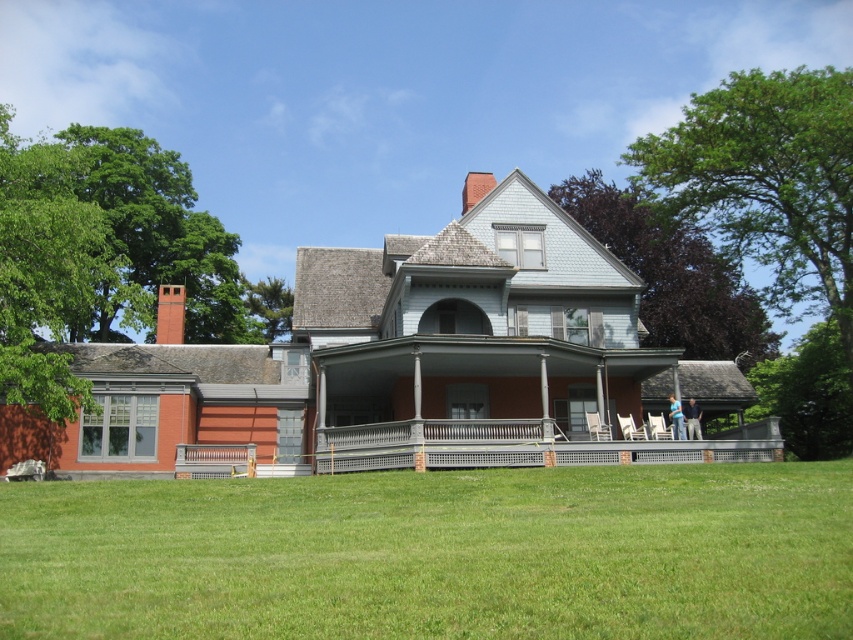
Can you confirm if gray wooden porch at center is bigger than blue jeans at center?

Indeed, gray wooden porch at center has a larger size compared to blue jeans at center.

You are a GUI agent. You are given a task and a screenshot of the screen. Output one action in this format:
    pyautogui.click(x=<x>, y=<y>)
    Task: Click on the gray wooden porch at center
    This screenshot has height=640, width=853.
    Given the screenshot: What is the action you would take?
    pyautogui.click(x=525, y=445)

You are a GUI agent. You are given a task and a screenshot of the screen. Output one action in this format:
    pyautogui.click(x=<x>, y=<y>)
    Task: Click on the gray wooden porch at center
    
    Given the screenshot: What is the action you would take?
    pyautogui.click(x=525, y=445)

Can you confirm if green grass at lower center is positioned above blue jeans at center?

No.

Can you confirm if green grass at lower center is bigger than blue jeans at center?

Yes.

Image resolution: width=853 pixels, height=640 pixels. What do you see at coordinates (436, 554) in the screenshot?
I see `green grass at lower center` at bounding box center [436, 554].

Where is `green grass at lower center`? green grass at lower center is located at coordinates (436, 554).

Can you confirm if gray wooden porch at center is smaller than blue fabric shirt at lower right?

No, gray wooden porch at center is not smaller than blue fabric shirt at lower right.

Does gray wooden porch at center appear under blue fabric shirt at lower right?

Correct, gray wooden porch at center is located below blue fabric shirt at lower right.

Who is more forward, (730, 432) or (672, 410)?

Point (672, 410) is more forward.

The height and width of the screenshot is (640, 853). In order to click on gray wooden porch at center in this screenshot , I will do `click(525, 445)`.